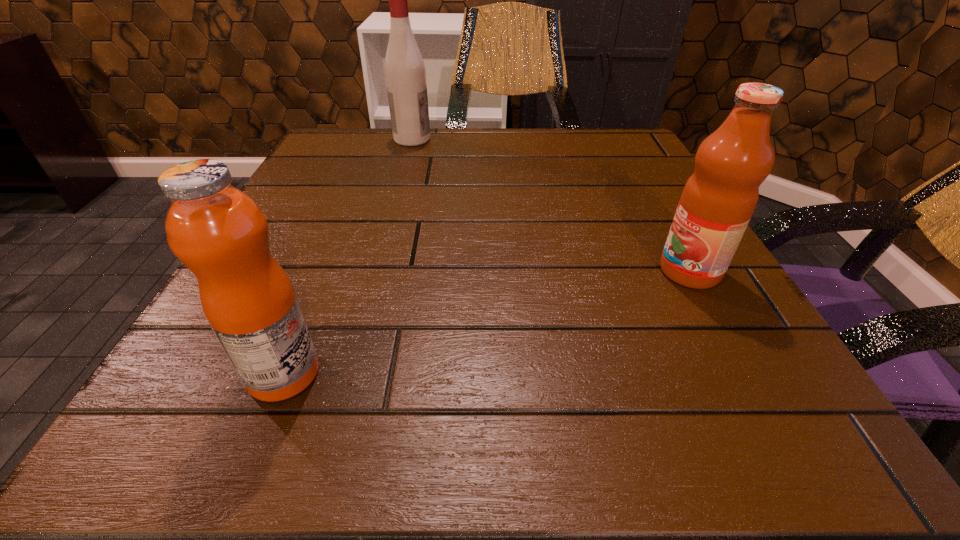
The width and height of the screenshot is (960, 540). I want to click on free space between the farthest object and the right fruit juice, so click(x=551, y=205).

Locate an element on the screen. The image size is (960, 540). empty space that is in between the farther fruit juice and the farthest object is located at coordinates (551, 205).

I want to click on free space between the farthest object and the right fruit juice, so click(x=551, y=205).

This screenshot has height=540, width=960. In order to click on vacant space in between the left fruit juice and the rightmost object in this screenshot , I will do `click(487, 322)`.

Locate an element on the screen. the second closest object to the second farthest object is located at coordinates (405, 74).

Where is `the second closest object to the nearer fruit juice`? The height and width of the screenshot is (540, 960). the second closest object to the nearer fruit juice is located at coordinates (405, 74).

The image size is (960, 540). Find the location of `free spot that satisfies the following two spatial constraints: 1. on the label of the farthest object; 2. on the front side of the left fruit juice`. free spot that satisfies the following two spatial constraints: 1. on the label of the farthest object; 2. on the front side of the left fruit juice is located at coordinates click(348, 373).

This screenshot has height=540, width=960. In order to click on vacant region that satisfies the following two spatial constraints: 1. on the front label of the right fruit juice; 2. on the front side of the left fruit juice in this screenshot , I will do `click(746, 373)`.